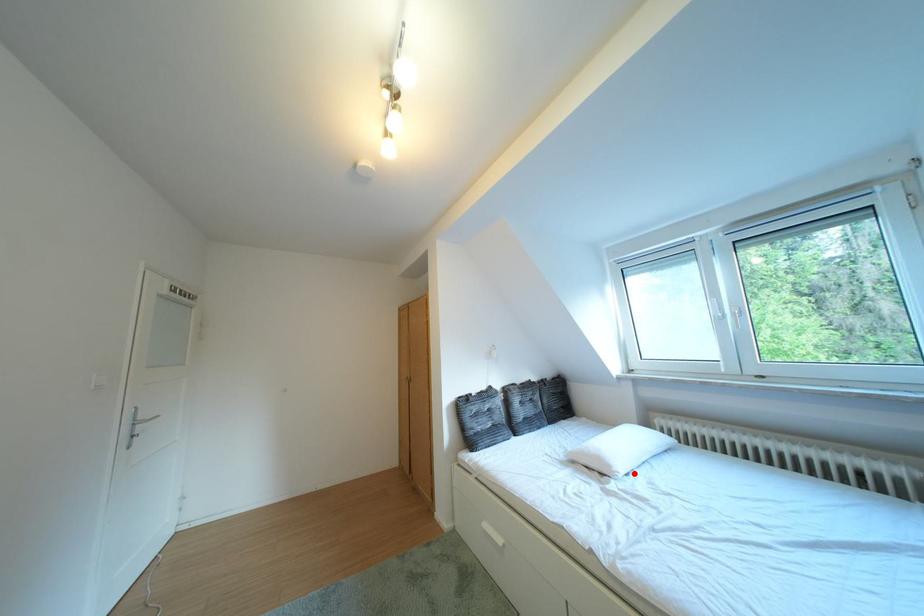
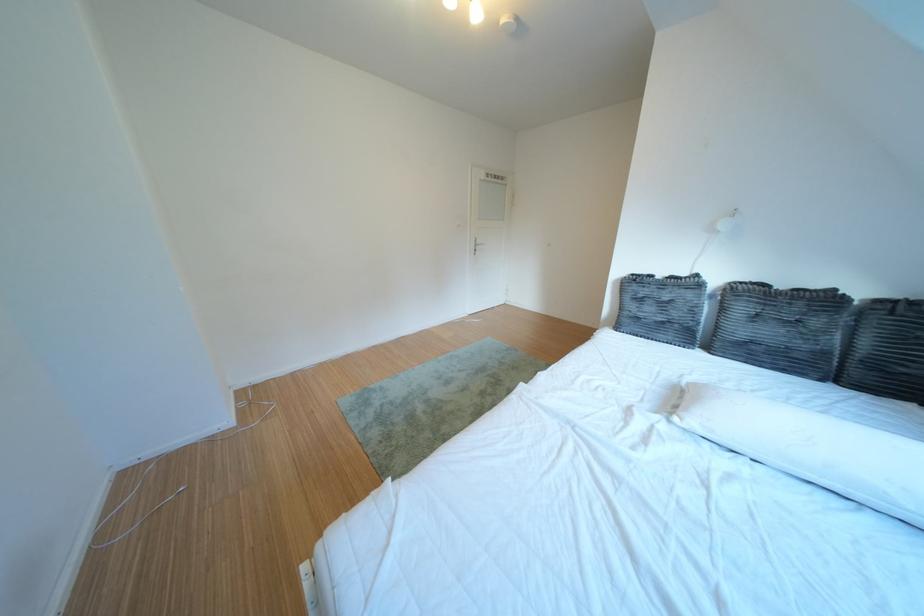
Find the pixel in the second image that matches the highlighted location in the first image.

(707, 424)